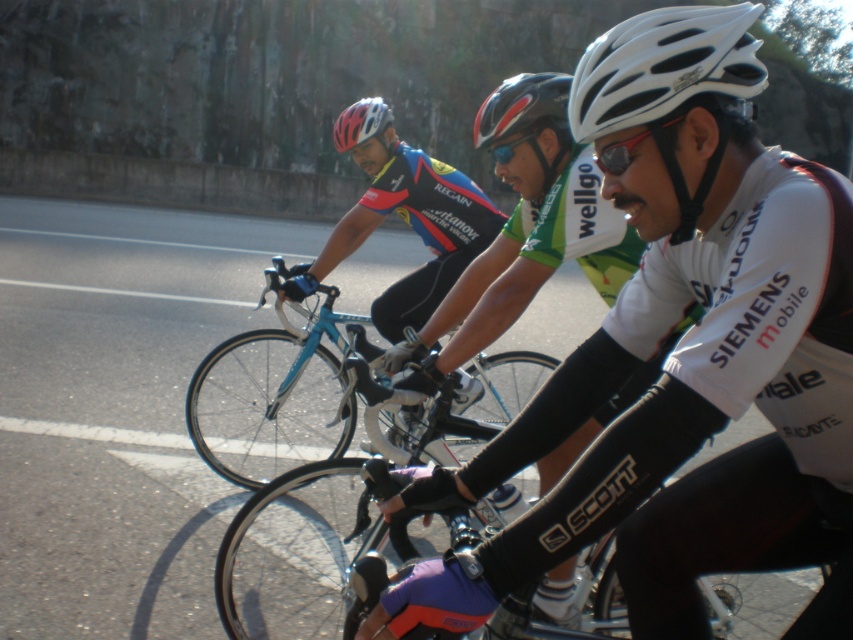
From the picture: Can you confirm if white matte helmet at center is shorter than purple matte bicycle handlebar at center?

Incorrect, white matte helmet at center's height does not fall short of purple matte bicycle handlebar at center's.

Does point (711, 198) come closer to viewer compared to point (346, 604)?

Yes, point (711, 198) is closer to viewer.

In order to click on white matte helmet at center in this screenshot , I will do `click(682, 355)`.

Is shiny blue bicycle at center further to camera compared to matte white helmet at upper center?

That is False.

Does shiny blue bicycle at center have a smaller size compared to matte white helmet at upper center?

Yes, shiny blue bicycle at center is smaller than matte white helmet at upper center.

Is point (300, 346) positioned before point (345, 122)?

No, (300, 346) is further to viewer.

Image resolution: width=853 pixels, height=640 pixels. I want to click on shiny blue bicycle at center, so click(276, 396).

At what (x,y) coordinates should I click in order to perform the action: click on purple matte bicycle handlebar at center. Please return your answer as a coordinate pair (x, y). The height and width of the screenshot is (640, 853). Looking at the image, I should click on (305, 552).

Who is shorter, purple matte bicycle handlebar at center or glossy black helmet at center?

With less height is purple matte bicycle handlebar at center.

Find the location of `purple matte bicycle handlebar at center`. purple matte bicycle handlebar at center is located at coordinates (305, 552).

Identify the location of purple matte bicycle handlebar at center. (305, 552).